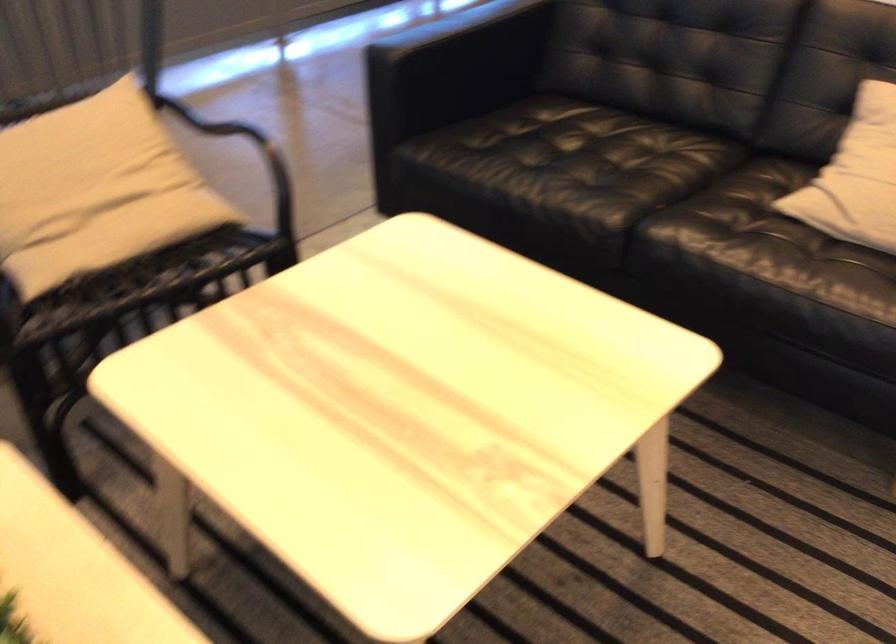
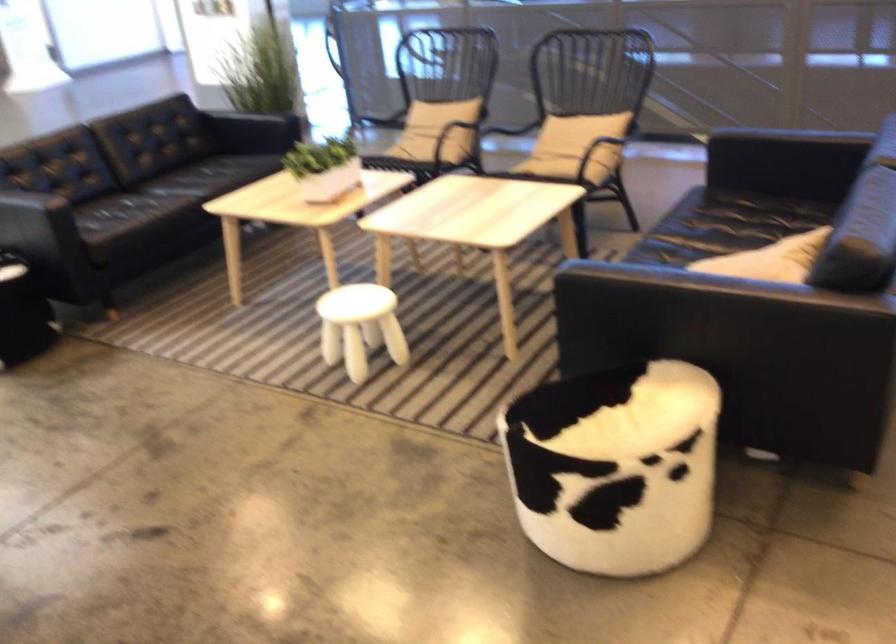
The point at (159, 228) is marked in the first image. Where is the corresponding point in the second image?

(552, 160)